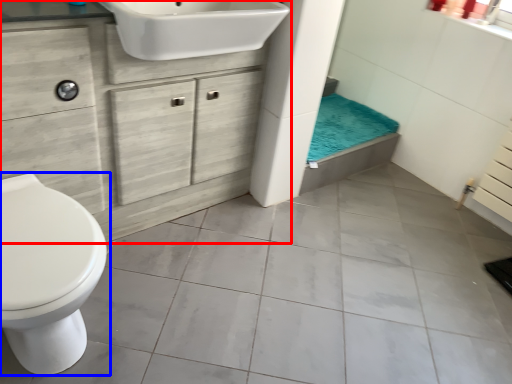
Question: Which of the following is the closest to the observer, bathroom cabinet (highlighted by a red box) or toilet (highlighted by a blue box)?

Choices:
 (A) bathroom cabinet
 (B) toilet

Answer: (B)